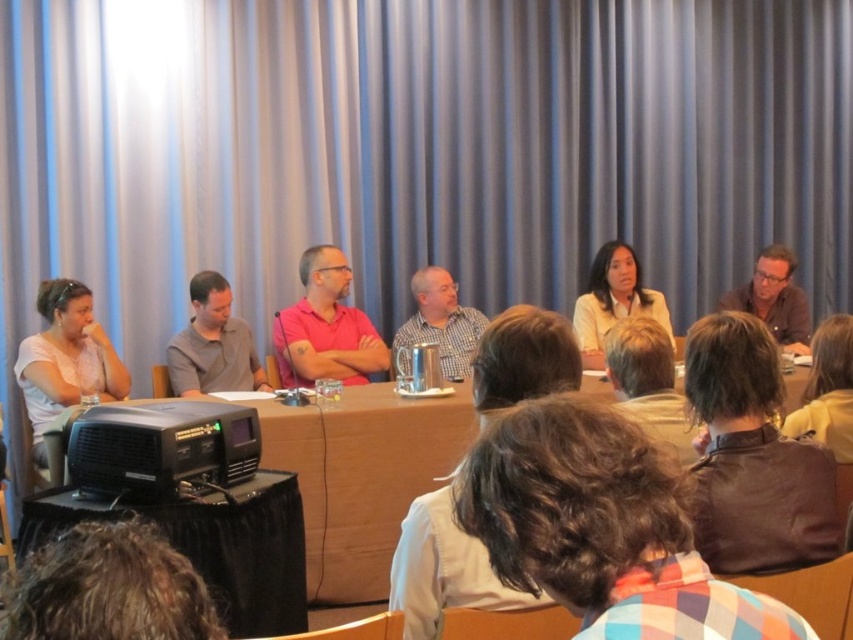
Question: Is checkered fabric shirt at center below matte brown shirt at right?

Choices:
 (A) yes
 (B) no

Answer: (A)

Question: Is checkered shirt at center further to camera compared to checkered fabric shirt at center?

Choices:
 (A) yes
 (B) no

Answer: (B)

Question: Among these points, which one is nearest to the camera?

Choices:
 (A) (631, 262)
 (B) (65, 556)

Answer: (B)

Question: Which point is farther to the camera?

Choices:
 (A) gray casual shirt at center
 (B) white matte shirt at left
 (C) brown wood table at center

Answer: (A)

Question: Is brown hair at center to the left of white matte shirt at left from the viewer's perspective?

Choices:
 (A) yes
 (B) no

Answer: (B)

Question: Which point is closer to the camera?

Choices:
 (A) pink matte shirt at center
 (B) checkered fabric shirt at center
 (C) brown leather jacket at lower right

Answer: (C)